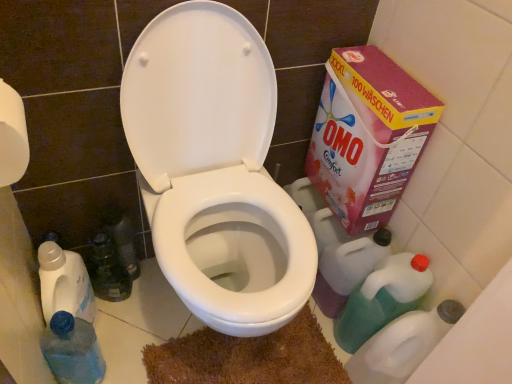
Question: Does white glossy toilet at center contain pink cardboard box at right?

Choices:
 (A) yes
 (B) no

Answer: (B)

Question: Can you confirm if white glossy toilet at center is wider than pink cardboard box at right?

Choices:
 (A) yes
 (B) no

Answer: (A)

Question: Does white glossy toilet at center have a greater height compared to pink cardboard box at right?

Choices:
 (A) no
 (B) yes

Answer: (B)

Question: Is white glossy toilet at center turned away from pink cardboard box at right?

Choices:
 (A) yes
 (B) no

Answer: (B)

Question: Could you tell me if white glossy toilet at center is turned towards pink cardboard box at right?

Choices:
 (A) yes
 (B) no

Answer: (B)

Question: From a real-world perspective, is green translucent bottle at lower right, the second cleaning product ordered from the bottom, above or below translucent plastic bottle at lower left?

Choices:
 (A) above
 (B) below

Answer: (A)

Question: Is green translucent bottle at lower right, the second cleaning product ordered from the bottom, to the left or to the right of translucent plastic bottle at lower left in the image?

Choices:
 (A) right
 (B) left

Answer: (A)

Question: From the image's perspective, is green translucent bottle at lower right, the second cleaning product ordered from the bottom, above or below translucent plastic bottle at lower left?

Choices:
 (A) above
 (B) below

Answer: (A)

Question: Considering the positions of green translucent bottle at lower right, the second cleaning product ordered from the bottom, and translucent plastic bottle at lower left in the image, is green translucent bottle at lower right, the second cleaning product ordered from the bottom, wider or thinner than translucent plastic bottle at lower left?

Choices:
 (A) wide
 (B) thin

Answer: (A)

Question: From a real-world perspective, is translucent plastic bottle at lower right, marked as the first cleaning product in a bottom-to-top arrangement, physically located above or below white glossy toilet at center?

Choices:
 (A) above
 (B) below

Answer: (B)

Question: Is translucent plastic bottle at lower right, marked as the first cleaning product in a bottom-to-top arrangement, to the left or to the right of white glossy toilet at center in the image?

Choices:
 (A) right
 (B) left

Answer: (A)

Question: From the image's perspective, is translucent plastic bottle at lower right, placed as the 2th cleaning product when sorted from top to bottom, positioned above or below white glossy toilet at center?

Choices:
 (A) above
 (B) below

Answer: (B)

Question: Considering their positions, is translucent plastic bottle at lower right, marked as the first cleaning product in a bottom-to-top arrangement, located in front of or behind white glossy toilet at center?

Choices:
 (A) behind
 (B) front

Answer: (A)

Question: From their relative heights in the image, would you say white glossy toilet at center is taller or shorter than pink cardboard box at right?

Choices:
 (A) short
 (B) tall

Answer: (B)

Question: Considering the positions of white glossy toilet at center and pink cardboard box at right in the image, is white glossy toilet at center wider or thinner than pink cardboard box at right?

Choices:
 (A) thin
 (B) wide

Answer: (B)